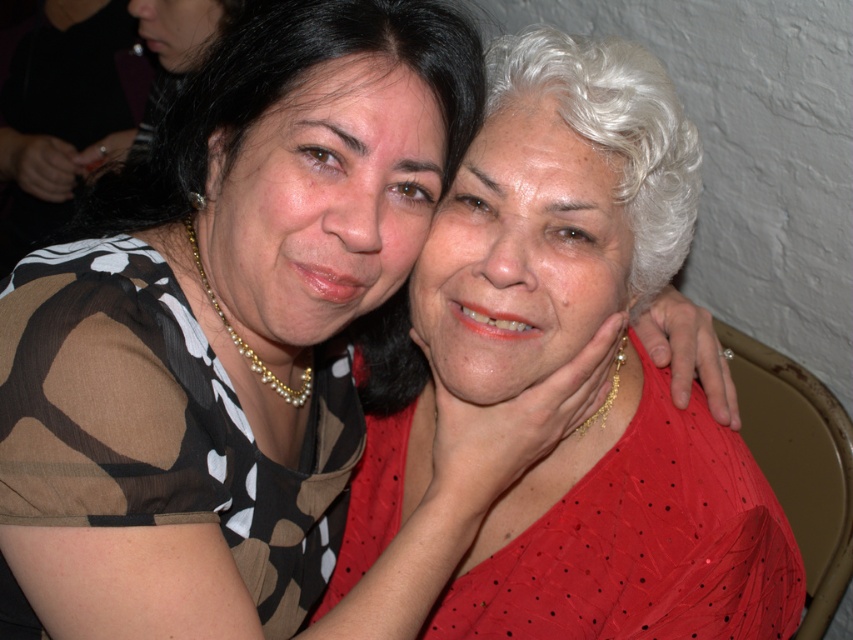
Does brown printed fabric dress at upper left have a greater width compared to red sheer dress at center?

No, brown printed fabric dress at upper left is not wider than red sheer dress at center.

Who is more forward, (82,314) or (508,632)?

Point (82,314) is in front.

This screenshot has width=853, height=640. Describe the element at coordinates (161, 422) in the screenshot. I see `brown printed fabric dress at upper left` at that location.

Image resolution: width=853 pixels, height=640 pixels. I want to click on brown printed fabric dress at upper left, so click(x=161, y=422).